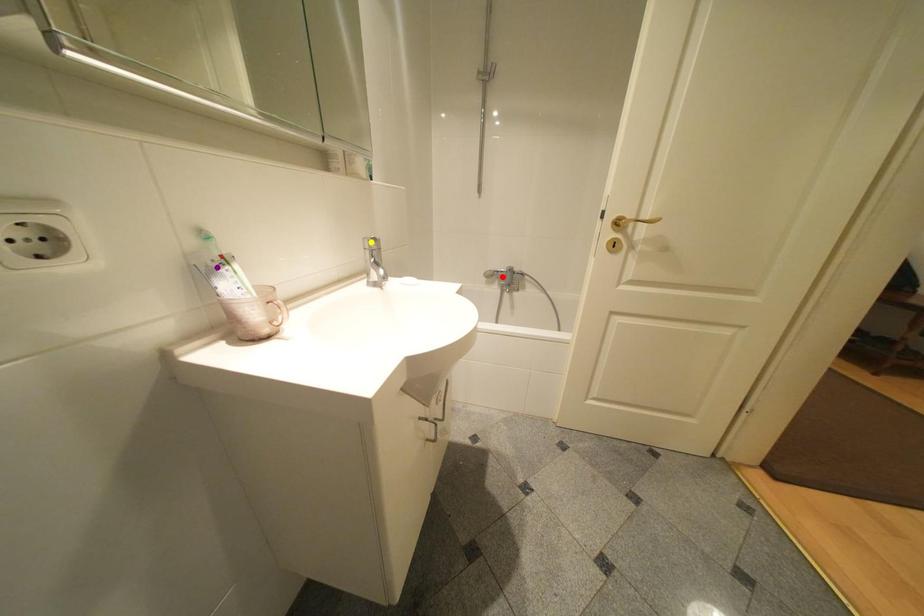
Order these from nearest to farthest:
yellow point | red point | purple point

purple point → yellow point → red point